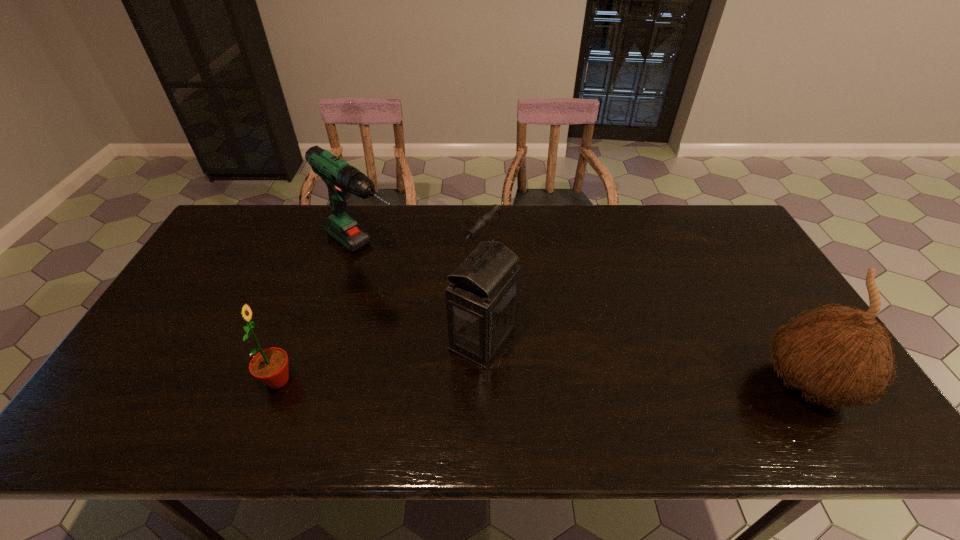
Where is `blank region between the sunflower and the drill`? blank region between the sunflower and the drill is located at coordinates click(321, 315).

Identify the location of vacant point located between the third object from left to right and the coconut. (645, 361).

Find the location of a particular element. The image size is (960, 540). unoccupied position between the tallest object and the drill is located at coordinates (423, 294).

This screenshot has height=540, width=960. Identify the location of object identified as the third closest to the farthest object. (841, 355).

Find the location of a particular element. object that stands as the closest to the coconut is located at coordinates (481, 299).